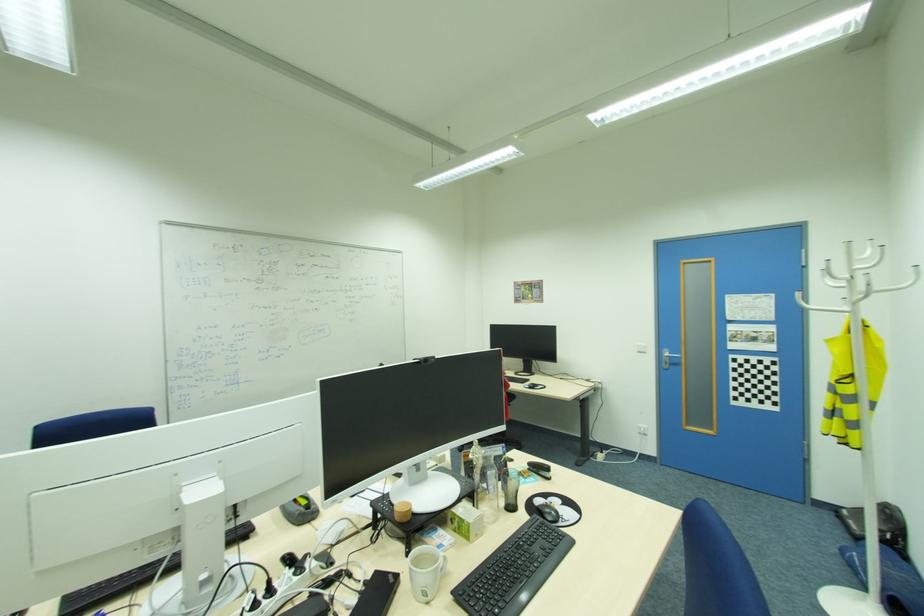
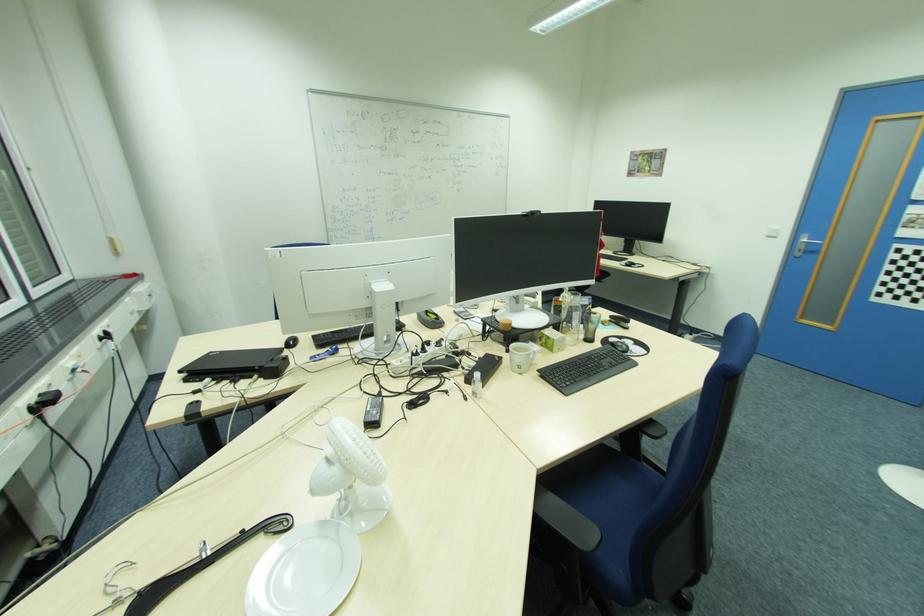
The point at (514, 507) is marked in the first image. Where is the corresponding point in the second image?

(591, 339)